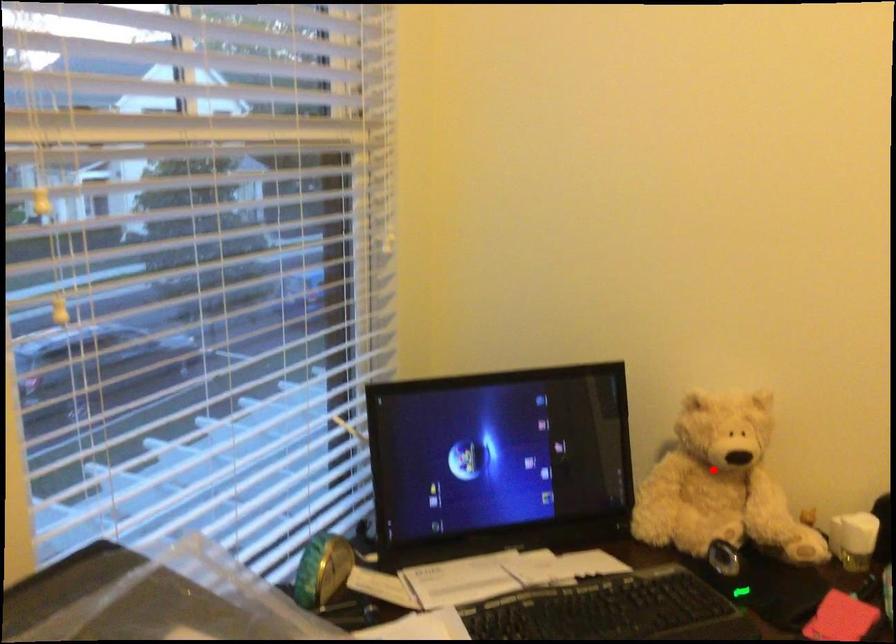
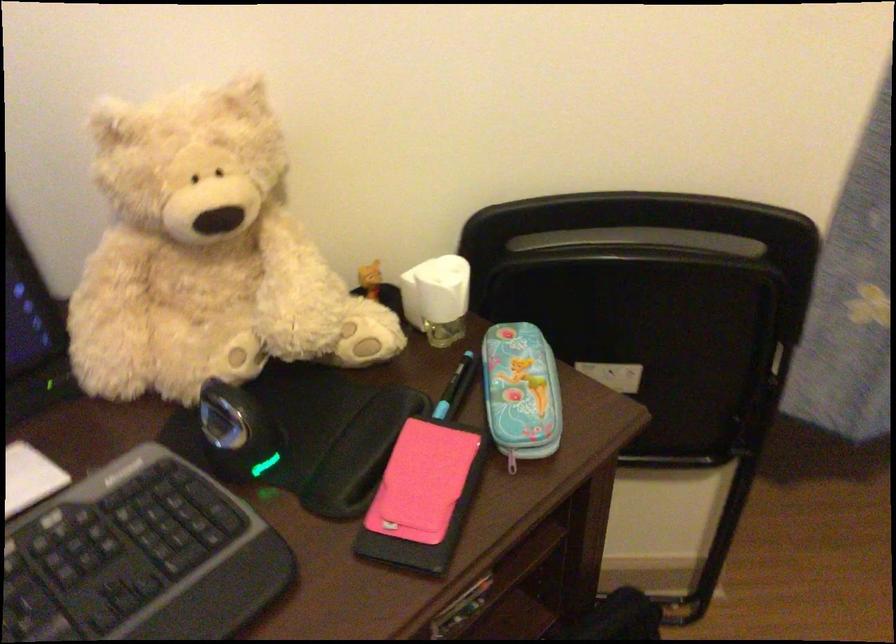
Question: I am providing you with two images of the same scene from different viewpoints. Image1 has a red point marked. In image2, the corresponding 3D location appears at what relative position? Reply with the corresponding letter.

Choices:
 (A) Closer
 (B) Farther

Answer: (A)